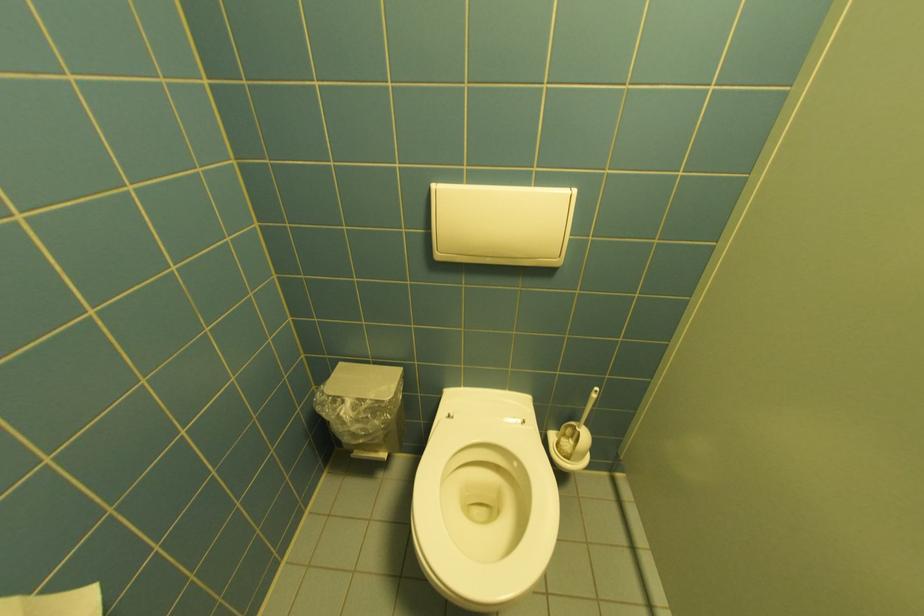
Where would you lift the white brush handle? Please return your answer as a coordinate pair (x, y).

(584, 419)